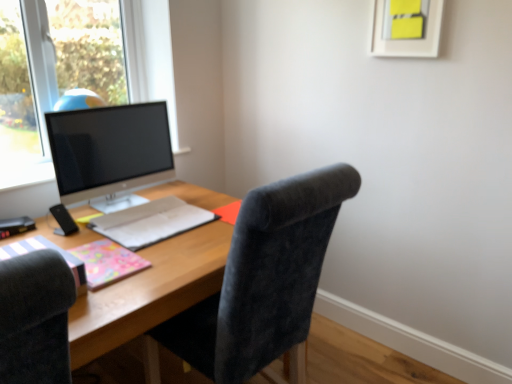
What is the approximate height of matte pink notebook at left, which is the third notebook in back-to-front order?

matte pink notebook at left, which is the third notebook in back-to-front order, is 4.04 inches tall.

In order to face matte pink notebook at left, which is the third notebook in back-to-front order, should I rotate leftwards or rightwards?

To face it directly, rotate left by 26.979 degrees.

At what (x,y) coordinates should I click in order to perform the action: click on velvet dark gray chair at center. Please return your answer as a coordinate pair (x, y). Looking at the image, I should click on (264, 278).

Image resolution: width=512 pixels, height=384 pixels. What do you see at coordinates (150, 292) in the screenshot?
I see `wooden desk at center` at bounding box center [150, 292].

Measure the distance between satin black monitor at left and camera.

They are 5.50 feet apart.

Identify the location of matte pink notebook at left, the 1th notebook from the front. The width and height of the screenshot is (512, 384). (47, 248).

Is wooden desk at center taller than satin black monitor at left?

Yes.

Which is behind, wooden desk at center or satin black monitor at left?

satin black monitor at left is behind.

Considering the sizes of objects wooden desk at center and satin black monitor at left in the image provided, who is thinner, wooden desk at center or satin black monitor at left?

With smaller width is satin black monitor at left.

Consider the image. Visually, is yellow paper at upper center positioned to the left or to the right of velvet dark gray chair at center?

In the image, yellow paper at upper center appears on the right side of velvet dark gray chair at center.

At what (x,y) coordinates should I click in order to perform the action: click on picture frame lying behind the velvet dark gray chair at center. Please return your answer as a coordinate pair (x, y). The height and width of the screenshot is (384, 512). Looking at the image, I should click on (406, 28).

Is yellow paper at upper center far from velvet dark gray chair at center?

Yes.

From a real-world perspective, is yellow paper at upper center located beneath velvet dark gray chair at center?

Actually, yellow paper at upper center is physically above velvet dark gray chair at center in the real world.

Is yellow paper at upper center far from pink glossy notebook at lower left, marked as the second notebook in a front-to-back arrangement?

Yes, yellow paper at upper center is far from pink glossy notebook at lower left, marked as the second notebook in a front-to-back arrangement.

Relative to pink glossy notebook at lower left, marked as the second notebook in a front-to-back arrangement, is yellow paper at upper center in front or behind?

Clearly, yellow paper at upper center is behind pink glossy notebook at lower left, marked as the second notebook in a front-to-back arrangement.

Where is `picture frame above the pink glossy notebook at lower left, marked as the second notebook in a front-to-back arrangement (from a real-world perspective)`? picture frame above the pink glossy notebook at lower left, marked as the second notebook in a front-to-back arrangement (from a real-world perspective) is located at coordinates (406, 28).

Between satin black monitor at left and matte gray notebook at center, which is the first notebook from back to front, which one is positioned in front?

matte gray notebook at center, which is the first notebook from back to front, is more forward.

From the picture: How much distance is there between satin black monitor at left and matte gray notebook at center, which is the first notebook from back to front?

12.23 inches.

Does satin black monitor at left have a greater height compared to matte gray notebook at center, which ranks as the third notebook in front-to-back order?

Correct, satin black monitor at left is much taller as matte gray notebook at center, which ranks as the third notebook in front-to-back order.

Looking at this image, considering the relative positions of satin black monitor at left and matte gray notebook at center, which is the first notebook from back to front, in the image provided, is satin black monitor at left to the right of matte gray notebook at center, which is the first notebook from back to front, from the viewer's perspective?

Incorrect, satin black monitor at left is not on the right side of matte gray notebook at center, which is the first notebook from back to front.

Does wooden desk at center have a larger size compared to velvet dark gray chair at center?

Yes, wooden desk at center is bigger than velvet dark gray chair at center.

From the image's perspective, which is below, wooden desk at center or velvet dark gray chair at center?

wooden desk at center, from the image's perspective.

From the picture: How many degrees apart are the facing directions of pink glossy notebook at lower left, positioned as the 2th notebook in back-to-front order, and wooden desk at center?

The facing directions of pink glossy notebook at lower left, positioned as the 2th notebook in back-to-front order, and wooden desk at center are 0.679 degrees apart.

Is pink glossy notebook at lower left, marked as the second notebook in a front-to-back arrangement, turned away from wooden desk at center?

pink glossy notebook at lower left, marked as the second notebook in a front-to-back arrangement, does not have its back to wooden desk at center.

Is wooden desk at center surrounded by pink glossy notebook at lower left, marked as the second notebook in a front-to-back arrangement?

That's incorrect, wooden desk at center is not inside pink glossy notebook at lower left, marked as the second notebook in a front-to-back arrangement.

From their relative heights in the image, would you say pink glossy notebook at lower left, positioned as the 2th notebook in back-to-front order, is taller or shorter than wooden desk at center?

Clearly, pink glossy notebook at lower left, positioned as the 2th notebook in back-to-front order, is shorter compared to wooden desk at center.

From a real-world perspective, does velvet dark gray chair at center stand above yellow paper at upper center?

No, from a real-world perspective, velvet dark gray chair at center is not above yellow paper at upper center.

Could you tell me if velvet dark gray chair at center is facing yellow paper at upper center?

No, velvet dark gray chair at center is not oriented towards yellow paper at upper center.

Considering the relative sizes of velvet dark gray chair at center and yellow paper at upper center in the image provided, is velvet dark gray chair at center shorter than yellow paper at upper center?

Incorrect, the height of velvet dark gray chair at center does not fall short of that of yellow paper at upper center.

This screenshot has width=512, height=384. Find the location of `desk on the right of satin black monitor at left`. desk on the right of satin black monitor at left is located at coordinates (150, 292).

The width and height of the screenshot is (512, 384). I want to click on chair below the yellow paper at upper center (from a real-world perspective), so [x=264, y=278].

From the image, which object appears to be farther from satin black monitor at left, pink glossy notebook at lower left, positioned as the 2th notebook in back-to-front order, or yellow paper at upper center?

yellow paper at upper center lies further to satin black monitor at left than the other object.

Which object lies nearer to the anchor point wooden desk at center, pink glossy notebook at lower left, marked as the second notebook in a front-to-back arrangement, or matte pink notebook at left, which is the third notebook in back-to-front order?

pink glossy notebook at lower left, marked as the second notebook in a front-to-back arrangement, lies closer to wooden desk at center than the other object.

Which object lies further to the anchor point matte gray notebook at center, which is the first notebook from back to front, wooden desk at center or yellow paper at upper center?

yellow paper at upper center.

Looking at the image, which one is located closer to wooden desk at center, matte gray notebook at center, which ranks as the third notebook in front-to-back order, or satin black monitor at left?

matte gray notebook at center, which ranks as the third notebook in front-to-back order, is closer to wooden desk at center.

Estimate the real-world distances between objects in this image. Which object is closer to velvet dark gray chair at center, yellow paper at upper center or matte gray notebook at center, which ranks as the third notebook in front-to-back order?

matte gray notebook at center, which ranks as the third notebook in front-to-back order, is closer to velvet dark gray chair at center.

Based on their spatial positions, is yellow paper at upper center or pink glossy notebook at lower left, positioned as the 2th notebook in back-to-front order, closer to matte pink notebook at left, which is the third notebook in back-to-front order?

pink glossy notebook at lower left, positioned as the 2th notebook in back-to-front order, is closer to matte pink notebook at left, which is the third notebook in back-to-front order.

Considering their positions, is wooden desk at center positioned closer to pink glossy notebook at lower left, marked as the second notebook in a front-to-back arrangement, than matte gray notebook at center, which is the first notebook from back to front?

wooden desk at center is closer to pink glossy notebook at lower left, marked as the second notebook in a front-to-back arrangement.

Estimate the real-world distances between objects in this image. Which object is closer to velvet dark gray chair at center, satin black monitor at left or matte gray notebook at center, which ranks as the third notebook in front-to-back order?

matte gray notebook at center, which ranks as the third notebook in front-to-back order, is closer to velvet dark gray chair at center.

Where is `desk located between matte pink notebook at left, which is the third notebook in back-to-front order, and yellow paper at upper center in the left-right direction`? desk located between matte pink notebook at left, which is the third notebook in back-to-front order, and yellow paper at upper center in the left-right direction is located at coordinates 150,292.

This screenshot has width=512, height=384. I want to click on chair situated between matte pink notebook at left, the 1th notebook from the front, and yellow paper at upper center from left to right, so click(264, 278).

Locate an element on the screen. Image resolution: width=512 pixels, height=384 pixels. chair between satin black monitor at left and wooden desk at center in the vertical direction is located at coordinates (264, 278).

Image resolution: width=512 pixels, height=384 pixels. I want to click on notebook between matte pink notebook at left, which is the third notebook in back-to-front order, and matte gray notebook at center, which ranks as the third notebook in front-to-back order, in the front-back direction, so click(x=106, y=262).